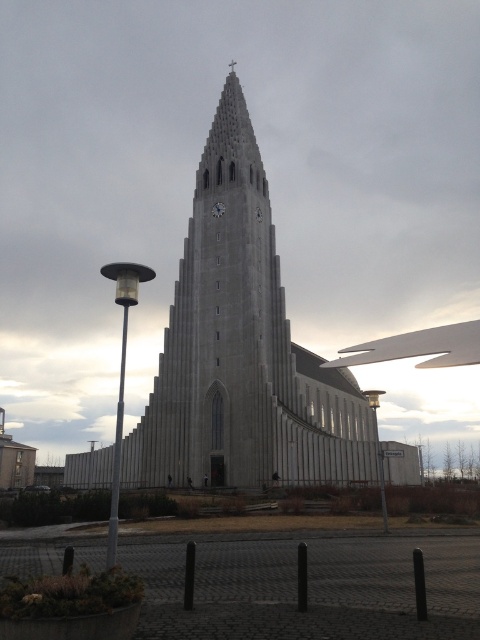
Is gray stone church at center smaller than metallic clock at center?

Actually, gray stone church at center might be larger than metallic clock at center.

Can you confirm if gray stone church at center is taller than metallic clock at center?

Correct, gray stone church at center is much taller as metallic clock at center.

Does point (332, 433) come behind point (217, 216)?

That is False.

Locate an element on the screen. gray stone church at center is located at coordinates [x=241, y=349].